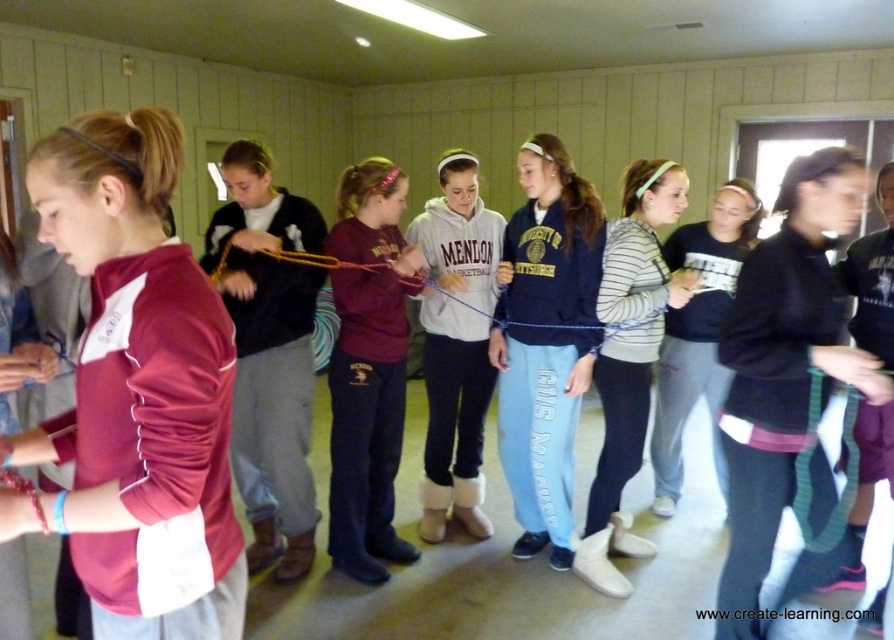
Question: From the image, what is the correct spatial relationship of maroon jersey at left in relation to maroon fleece sweater at center?

Choices:
 (A) right
 (B) left

Answer: (A)

Question: Is maroon fleece sweater at center to the left of maroon fleece sweatshirt at center from the viewer's perspective?

Choices:
 (A) yes
 (B) no

Answer: (A)

Question: Which of the following is the farthest from the observer?

Choices:
 (A) (817, 570)
 (B) (365, 496)
 (C) (292, 452)

Answer: (B)

Question: In this image, where is black matte sweatshirt at center located relative to white striped sweater at center?

Choices:
 (A) below
 (B) above

Answer: (A)

Question: Which point is closer to the camera?

Choices:
 (A) gray fleece sweatshirt at center
 (B) striped sweater at center
 (C) maroon jersey at left

Answer: (C)

Question: Estimate the real-world distances between objects in this image. Which object is closer to the maroon jersey at left?

Choices:
 (A) black matte sweatshirt at center
 (B) white striped sweater at center

Answer: (A)